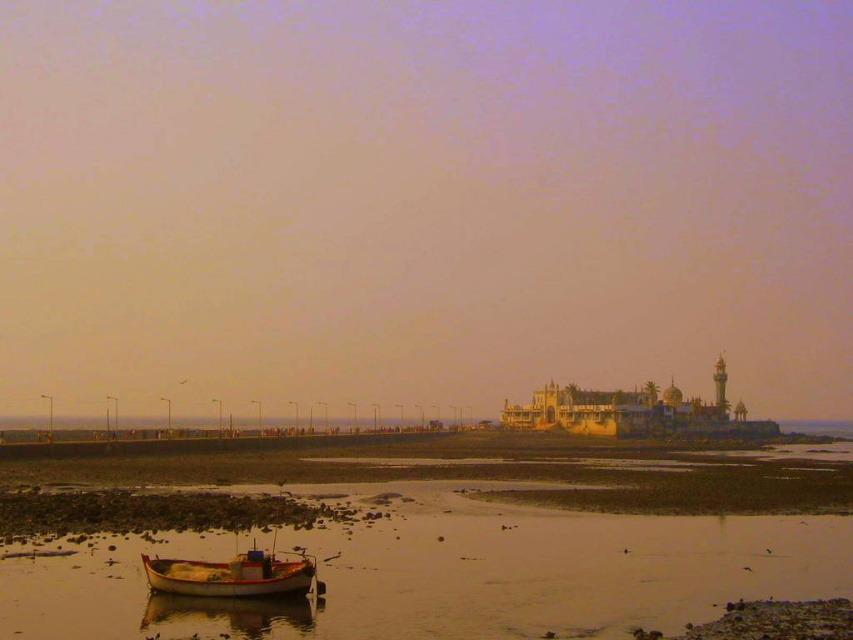
Question: Does smooth sand beach at lower left come behind wooden boat at lower left?

Choices:
 (A) no
 (B) yes

Answer: (A)

Question: Which of the following is the closest to the observer?

Choices:
 (A) (547, 536)
 (B) (196, 577)

Answer: (B)

Question: Where is smooth sand beach at lower left located in relation to wooden boat at lower left in the image?

Choices:
 (A) below
 (B) above

Answer: (A)

Question: Which point is farther to the camera?

Choices:
 (A) (x=265, y=573)
 (B) (x=601, y=573)

Answer: (B)

Question: Among these objects, which one is farthest from the camera?

Choices:
 (A) wooden boat at lower left
 (B) smooth sand beach at lower left

Answer: (A)

Question: Does smooth sand beach at lower left appear on the right side of wooden boat at lower left?

Choices:
 (A) yes
 (B) no

Answer: (A)